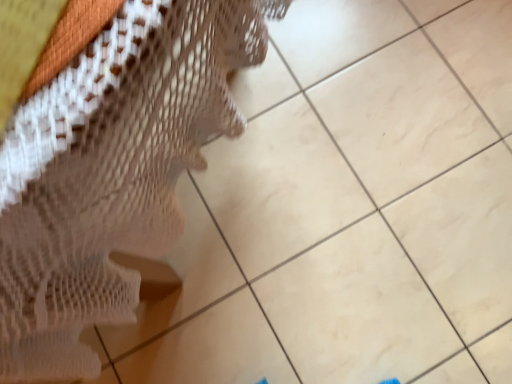
The image size is (512, 384). Describe the element at coordinates (108, 163) in the screenshot. I see `brown woven basket at upper left` at that location.

This screenshot has width=512, height=384. Identify the location of brown woven basket at upper left. (108, 163).

At what (x,y) coordinates should I click in order to perform the action: click on brown woven basket at upper left. Please return your answer as a coordinate pair (x, y). This screenshot has width=512, height=384. Looking at the image, I should click on pos(108,163).